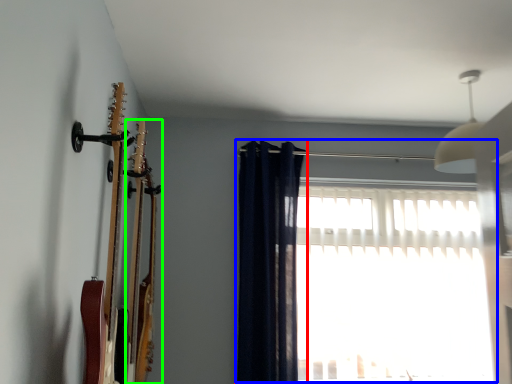
Question: Based on their relative distances, which object is nearer to curtain (highlighted by a red box)? Choose from window (highlighted by a blue box) and guitar (highlighted by a green box).

Choices:
 (A) window
 (B) guitar

Answer: (A)